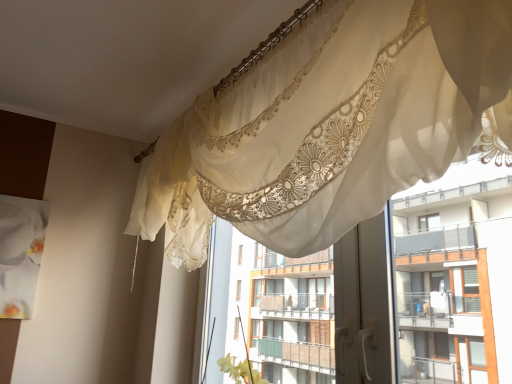
Question: Does sheer lace curtain at upper center turn towards sheer lace curtains at upper center?

Choices:
 (A) no
 (B) yes

Answer: (A)

Question: Does sheer lace curtain at upper center have a larger size compared to sheer lace curtains at upper center?

Choices:
 (A) yes
 (B) no

Answer: (A)

Question: Can you confirm if sheer lace curtain at upper center is taller than sheer lace curtains at upper center?

Choices:
 (A) no
 (B) yes

Answer: (A)

Question: Does sheer lace curtain at upper center appear on the right side of sheer lace curtains at upper center?

Choices:
 (A) no
 (B) yes

Answer: (A)

Question: Is sheer lace curtain at upper center not inside sheer lace curtains at upper center?

Choices:
 (A) no
 (B) yes

Answer: (B)

Question: Is there a large distance between sheer lace curtain at upper center and sheer lace curtains at upper center?

Choices:
 (A) yes
 (B) no

Answer: (A)

Question: Is sheer lace curtains at upper center at the right side of sheer lace curtain at upper center?

Choices:
 (A) yes
 (B) no

Answer: (A)

Question: Is sheer lace curtain at upper center surrounded by sheer lace curtains at upper center?

Choices:
 (A) yes
 (B) no

Answer: (B)

Question: Is sheer lace curtains at upper center turned away from sheer lace curtain at upper center?

Choices:
 (A) no
 (B) yes

Answer: (A)

Question: Is sheer lace curtains at upper center wider than sheer lace curtain at upper center?

Choices:
 (A) yes
 (B) no

Answer: (B)

Question: Can you confirm if sheer lace curtains at upper center is bigger than sheer lace curtain at upper center?

Choices:
 (A) yes
 (B) no

Answer: (B)

Question: Can you confirm if sheer lace curtains at upper center is taller than sheer lace curtain at upper center?

Choices:
 (A) yes
 (B) no

Answer: (A)

Question: From the image's perspective, is sheer lace curtains at upper center above or below sheer lace curtain at upper center?

Choices:
 (A) above
 (B) below

Answer: (B)